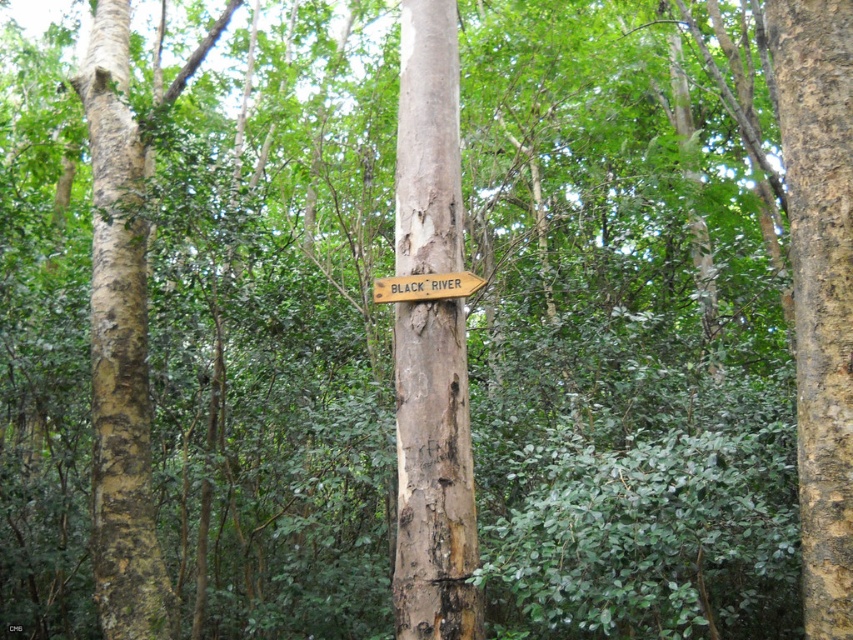
You are a hiker who wants to find the Black River. You see a brown rough bark sign at center and a wooden sign at center. Which sign is closer to the ground?

The brown rough bark sign at center is located below the wooden sign at center, so it is closer to the ground.

You are standing in a dense forest with a wooden sign pointing towards the Black River. You see a point marked at coordinates (120, 344). Based on the scene description, what does this point likely represent?

The point at (120, 344) indicates the location of the light brown bark tree trunk at left where the wooden sign is attached.

Consider the image. You are standing in the forest looking at the wooden sign indicating the Black River. There are two points marked in the scene. Which point, point (410, 508) or point (416, 278), is closer to you?

Point (410, 508) is closer to you than point (416, 278).